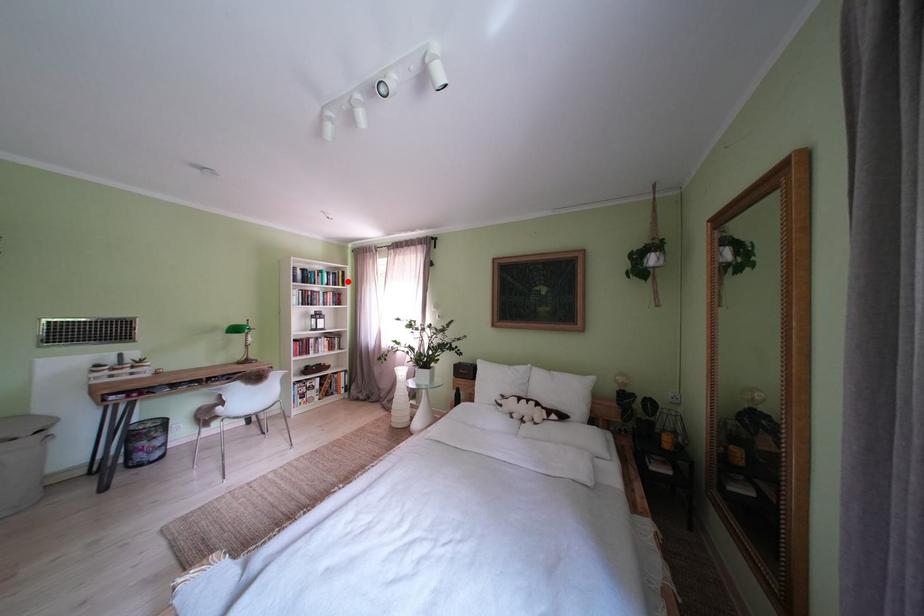
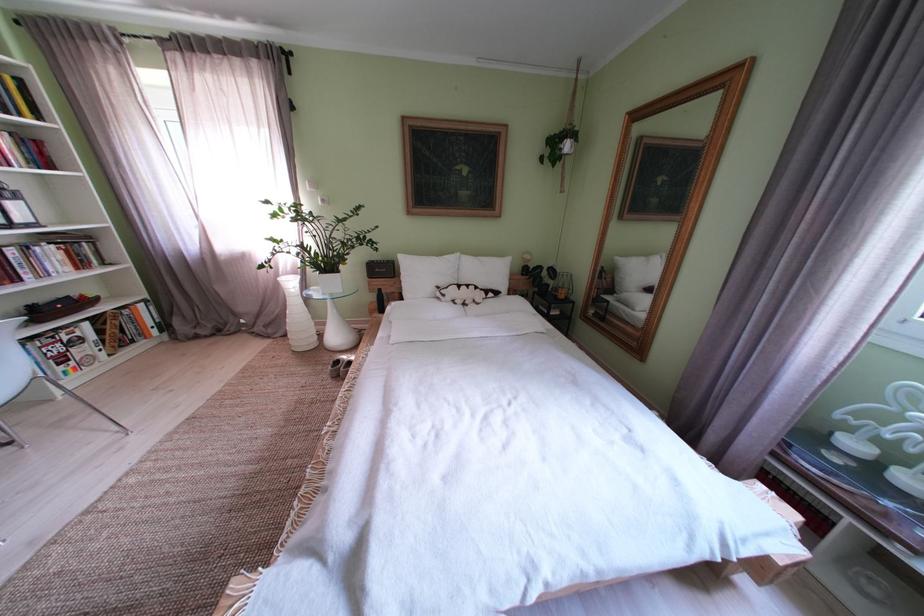
Find the pixel in the second image that matches the highlighted location in the first image.

(9, 92)